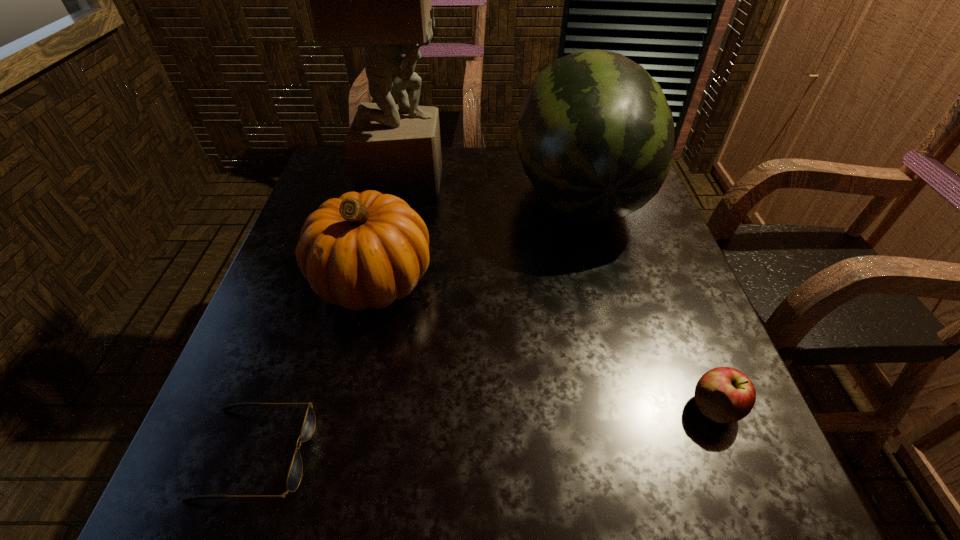
Where is `sculpture`? sculpture is located at coordinates (381, 0).

Locate an element on the screen. The width and height of the screenshot is (960, 540). the fourth shortest object is located at coordinates (595, 136).

This screenshot has height=540, width=960. I want to click on the third shortest object, so click(361, 250).

You are a GUI agent. You are given a task and a screenshot of the screen. Output one action in this format:
    pyautogui.click(x=<x>, y=<y>)
    Task: Click on the fourth tallest object
    This screenshot has width=960, height=540.
    Given the screenshot: What is the action you would take?
    pyautogui.click(x=723, y=394)

At what (x,y) coordinates should I click in order to perform the action: click on sunglasses. Please return your answer as a coordinate pair (x, y). This screenshot has width=960, height=540. Looking at the image, I should click on (294, 477).

Image resolution: width=960 pixels, height=540 pixels. In order to click on free space located 0.150m on the front-facing side of the sculpture in this screenshot , I will do `click(497, 178)`.

Where is `vacant space positioned 0.100m on the left of the fourth shortest object`? This screenshot has width=960, height=540. vacant space positioned 0.100m on the left of the fourth shortest object is located at coordinates 477,194.

What are the coordinates of `vacant area located 0.230m on the back of the pumpkin` in the screenshot? It's located at (396, 186).

Find the location of a particular element. The image size is (960, 540). vacant space situated 0.230m on the left of the second shortest object is located at coordinates (556, 407).

Where is `vacant space located on the front-facing side of the shortest object`? The width and height of the screenshot is (960, 540). vacant space located on the front-facing side of the shortest object is located at coordinates (534, 454).